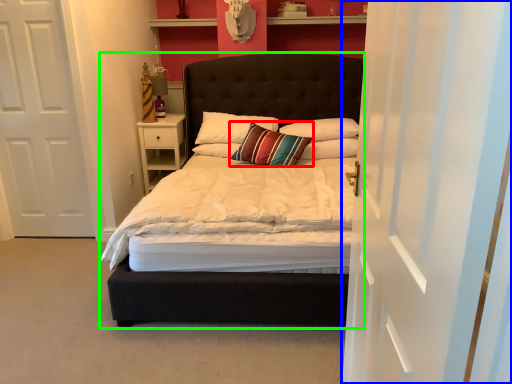
Question: Which is nearer to the pillow (highlighted by a red box)? curtain (highlighted by a blue box) or bed (highlighted by a green box).

Choices:
 (A) curtain
 (B) bed

Answer: (B)